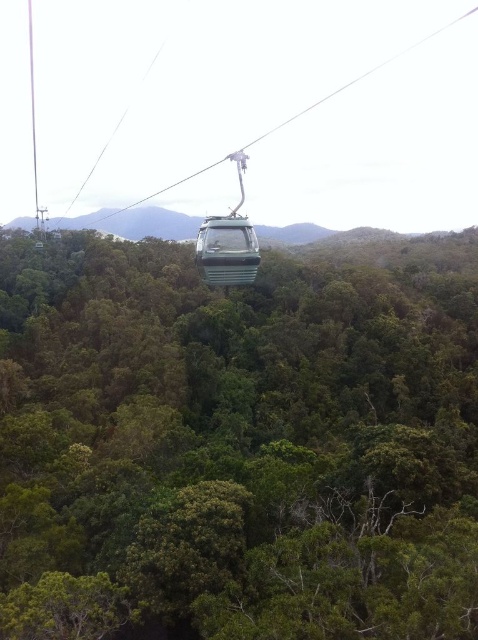
You are standing on a platform observing the green leafy tree at center and the metallic green cable car at center. Which object is positioned more to the left?

The green leafy tree at center is positioned more to the left than the metallic green cable car at center.

You are a park ranger planning to install a new bench in the forest. You want to ensure there is enough space between the green leafy tree at center and the metallic green cable car at center for visitors to comfortably walk. Based on their widths, can you determine if there is sufficient space between them?

The green leafy tree at center might be wider than metallic green cable car at center, so there may not be enough space between them for visitors to walk comfortably. Further measurements are needed to confirm.